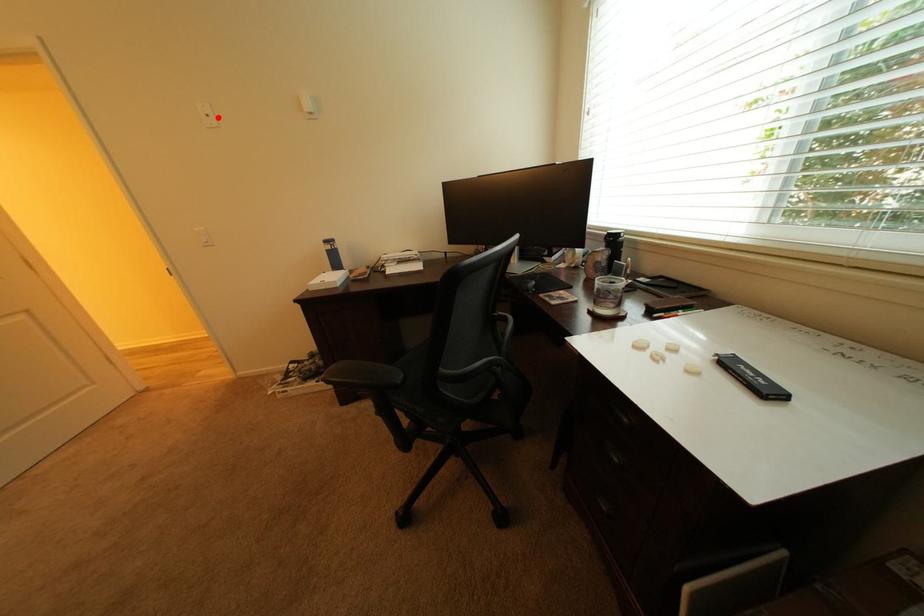
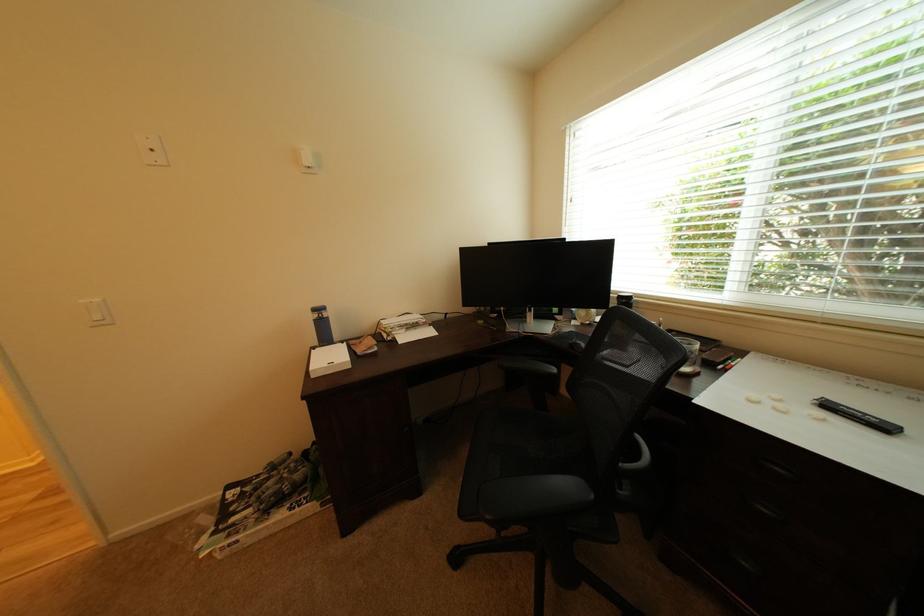
Where in the second image is the point corresponding to the highlighted location from the first image?

(163, 152)